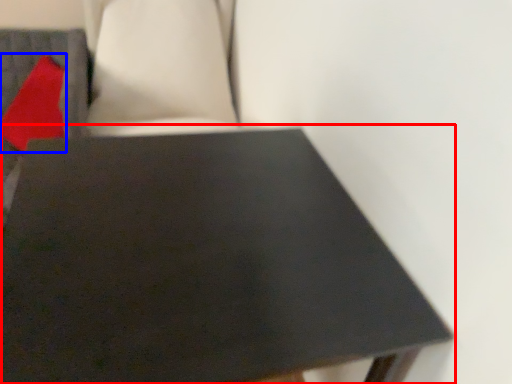
Question: Among these objects, which one is nearest to the camera, table (highlighted by a red box) or pillow (highlighted by a blue box)?

Choices:
 (A) table
 (B) pillow

Answer: (A)